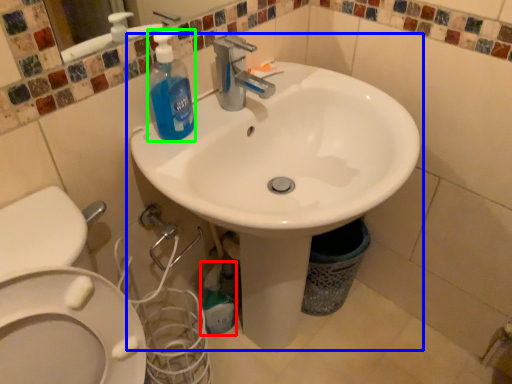
Question: Which is farther away from cleaning product (highlighted by a red box)? sink (highlighted by a blue box) or cleaning product (highlighted by a green box)?

Choices:
 (A) sink
 (B) cleaning product

Answer: (B)